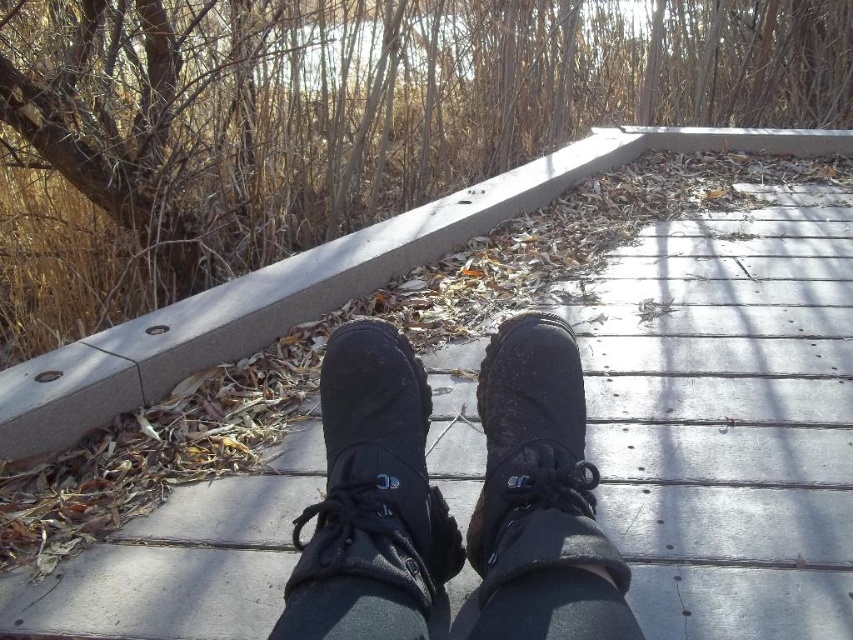
You are standing on a wooden deck with your black leather boots at center. You want to place a small potted plant exactly at the point marked as point (445, 502). Is there enough space there to place the plant without it being under your boots?

The black leather boots at center are located at point (445, 502), so placing the plant there would put it directly under the boots, making it unsuitable for placement.

You are trying to decide which boot to wear for a hike. The black leather boots at center and the matte black boot at center are both on the deck. Considering their height, which one would provide better ankle support?

The black leather boots at center are taller than the matte black boot at center, so they would provide better ankle support.

Based on the photo, you are standing on the wooden deck and want to place a small potted plant. The potted plant has a diameter of 20 cm. You want to place it at the location marked by point (370, 500). Is there enough space there?

The black leather boot at center is located at point (370, 500). Since the boot occupies that space, the potted plant cannot be placed there.